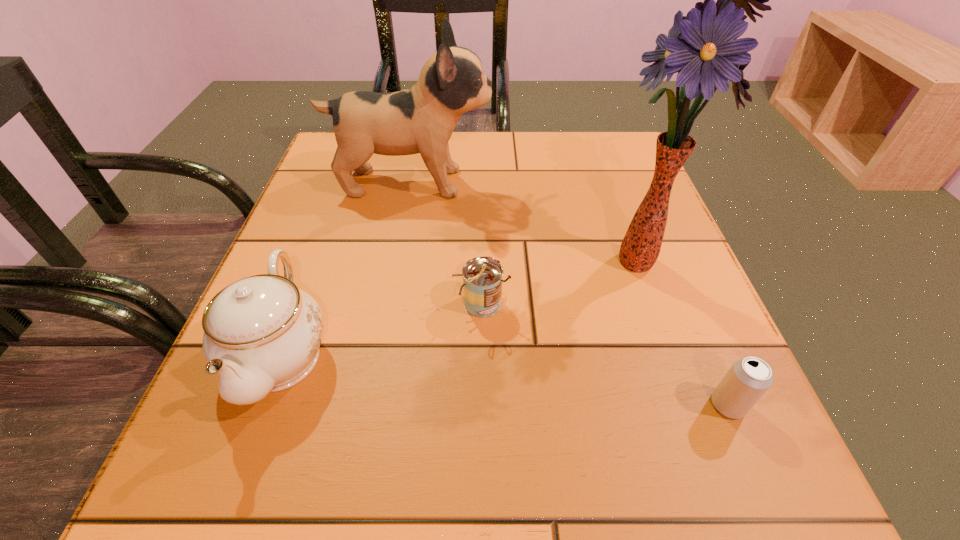
Find the location of a particular element. The image size is (960, 540). free region at the far left corner of the desktop is located at coordinates (335, 177).

You are a GUI agent. You are given a task and a screenshot of the screen. Output one action in this format:
    pyautogui.click(x=<x>, y=<y>)
    Task: Click on the vacant position at the far right corner of the desktop
    
    Given the screenshot: What is the action you would take?
    pyautogui.click(x=570, y=133)

In the image, there is a desktop. What are the coordinates of `free space at the near right corner` in the screenshot? It's located at (769, 474).

You are a GUI agent. You are given a task and a screenshot of the screen. Output one action in this format:
    pyautogui.click(x=<x>, y=<y>)
    Task: Click on the vacant space that's between the fourth tallest object and the second tallest object
    
    Given the screenshot: What is the action you would take?
    pyautogui.click(x=446, y=243)

Image resolution: width=960 pixels, height=540 pixels. Find the location of `vacant space that's between the farthest object and the flower arrangement`. vacant space that's between the farthest object and the flower arrangement is located at coordinates (524, 221).

What are the coordinates of `vacant space that's between the shortest object and the chinaware` in the screenshot? It's located at (505, 380).

You are a GUI agent. You are given a task and a screenshot of the screen. Output one action in this format:
    pyautogui.click(x=<x>, y=<y>)
    Task: Click on the vacant area that lies between the fourth tallest object and the beer can
    
    Given the screenshot: What is the action you would take?
    pyautogui.click(x=605, y=354)

The width and height of the screenshot is (960, 540). Identify the location of free space between the tallest object and the shortest object. (683, 332).

At what (x,y) coordinates should I click in order to perform the action: click on free space between the shortest object and the can. Please return your answer as a coordinate pair (x, y). The image size is (960, 540). Looking at the image, I should click on (605, 354).

Where is `free spot between the puppy and the third shortest object`? free spot between the puppy and the third shortest object is located at coordinates (347, 269).